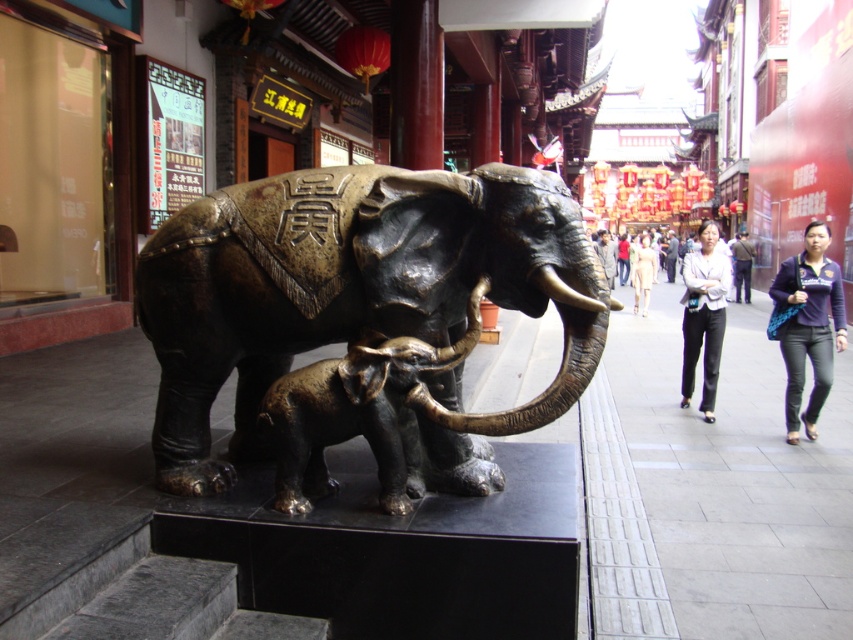
Is gray concrete pavement at lower right bigger than bronze baby elephant at center?

Correct, gray concrete pavement at lower right is larger in size than bronze baby elephant at center.

Which is more to the right, gray concrete pavement at lower right or bronze baby elephant at center?

From the viewer's perspective, gray concrete pavement at lower right appears more on the right side.

Who is more forward, (799,525) or (409,483)?

Point (409,483) is in front.

The width and height of the screenshot is (853, 640). Find the location of `gray concrete pavement at lower right`. gray concrete pavement at lower right is located at coordinates (712, 492).

Does bronze elephant at center have a smaller size compared to bronze baby elephant at center?

No, bronze elephant at center is not smaller than bronze baby elephant at center.

Is point (234, 429) closer to viewer compared to point (280, 384)?

No, it is behind (280, 384).

Find the location of a particular element. bronze elephant at center is located at coordinates (357, 300).

This screenshot has width=853, height=640. Describe the element at coordinates (712, 492) in the screenshot. I see `gray concrete pavement at lower right` at that location.

Is gray concrete pavement at lower right positioned in front of gold metallic tusk at center?

No.

Is point (596, 602) closer to viewer compared to point (541, 282)?

No, it is not.

I want to click on gray concrete pavement at lower right, so click(712, 492).